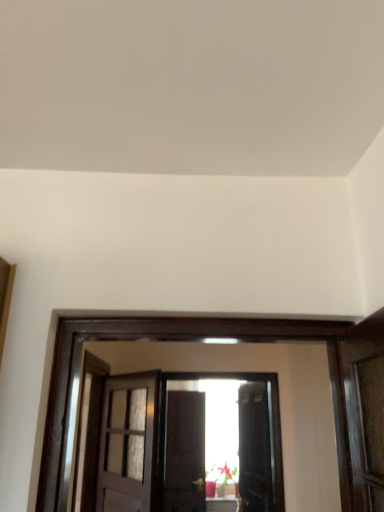
This screenshot has height=512, width=384. What do you see at coordinates (127, 443) in the screenshot? I see `matte white door at center, which is counted as the first door, starting from the left` at bounding box center [127, 443].

What are the coordinates of `matte white door at center, marked as the 2th door in a back-to-front arrangement` in the screenshot? It's located at click(127, 443).

The image size is (384, 512). What do you see at coordinates (254, 449) in the screenshot?
I see `matte black door at center, the first door from the right` at bounding box center [254, 449].

You are a GUI agent. You are given a task and a screenshot of the screen. Output one action in this format:
    pyautogui.click(x=<x>, y=<y>)
    Task: Click on the matte black door at center, marked as the second door in a left-to-right arrangement
    The image size is (384, 512).
    Given the screenshot: What is the action you would take?
    pyautogui.click(x=254, y=449)

Identify the location of matte white door at center, which is counted as the first door, starting from the left. (127, 443).

In the image, is matte white door at center, which is counted as the first door, starting from the left, on the left side or the right side of matte black door at center, the first door from the right?

From the image, it's evident that matte white door at center, which is counted as the first door, starting from the left, is to the left of matte black door at center, the first door from the right.

Considering the positions of objects matte white door at center, acting as the first door starting from the front, and matte black door at center, marked as the second door in a left-to-right arrangement, in the image provided, who is behind, matte white door at center, acting as the first door starting from the front, or matte black door at center, marked as the second door in a left-to-right arrangement,?

matte black door at center, marked as the second door in a left-to-right arrangement, is further from the camera.

Which point is more forward, (110, 511) or (269, 437)?

Point (110, 511)

Consider the image. From the image's perspective, does matte white door at center, marked as the 2th door in a back-to-front arrangement, appear lower than matte black door at center, marked as the second door in a left-to-right arrangement?

Actually, matte white door at center, marked as the 2th door in a back-to-front arrangement, appears above matte black door at center, marked as the second door in a left-to-right arrangement, in the image.

From a real-world perspective, is matte white door at center, marked as the 2th door in a back-to-front arrangement, below matte black door at center, which appears as the second door when viewed from the front?

No, from a real-world perspective, matte white door at center, marked as the 2th door in a back-to-front arrangement, is not beneath matte black door at center, which appears as the second door when viewed from the front.

Does matte white door at center, acting as the first door starting from the front, have a lesser width compared to matte black door at center, which appears as the second door when viewed from the front?

Correct, the width of matte white door at center, acting as the first door starting from the front, is less than that of matte black door at center, which appears as the second door when viewed from the front.

Looking at this image, is matte white door at center, marked as the 2th door in a back-to-front arrangement, taller or shorter than matte black door at center, the 1th door from the back?

matte white door at center, marked as the 2th door in a back-to-front arrangement, is shorter than matte black door at center, the 1th door from the back.

Can you confirm if matte white door at center, marked as the 2th door in a back-to-front arrangement, is bigger than matte black door at center, marked as the second door in a left-to-right arrangement?

Actually, matte white door at center, marked as the 2th door in a back-to-front arrangement, might be smaller than matte black door at center, marked as the second door in a left-to-right arrangement.

Is matte white door at center, the second door positioned from the right, not inside matte black door at center, the first door from the right?

Yes.

Can you see matte white door at center, which is counted as the first door, starting from the left, touching matte black door at center, marked as the second door in a left-to-right arrangement?

No, matte white door at center, which is counted as the first door, starting from the left, is not touching matte black door at center, marked as the second door in a left-to-right arrangement.

Is matte white door at center, the second door positioned from the right, looking in the opposite direction of matte black door at center, which appears as the second door when viewed from the front?

No, matte white door at center, the second door positioned from the right,'s orientation is not away from matte black door at center, which appears as the second door when viewed from the front.

The image size is (384, 512). In order to click on door above the matte black door at center, which appears as the second door when viewed from the front (from a real-world perspective) in this screenshot , I will do coord(127,443).

Does matte black door at center, the 1th door from the back, appear on the left side of matte white door at center, acting as the first door starting from the front?

In fact, matte black door at center, the 1th door from the back, is to the right of matte white door at center, acting as the first door starting from the front.

Who is more distant, matte black door at center, the 1th door from the back, or matte white door at center, marked as the 2th door in a back-to-front arrangement?

matte black door at center, the 1th door from the back, is further from the camera.

Is point (239, 394) positioned before point (140, 487)?

No.

From the image's perspective, is matte black door at center, the 1th door from the back, below matte white door at center, marked as the 2th door in a back-to-front arrangement?

Correct, matte black door at center, the 1th door from the back, appears lower than matte white door at center, marked as the 2th door in a back-to-front arrangement, in the image.

From a real-world perspective, is matte black door at center, marked as the second door in a left-to-right arrangement, located higher than matte white door at center, acting as the first door starting from the front?

No.

Which of these two, matte black door at center, marked as the second door in a left-to-right arrangement, or matte white door at center, which is counted as the first door, starting from the left, is wider?

With larger width is matte black door at center, marked as the second door in a left-to-right arrangement.

Can you confirm if matte black door at center, the 1th door from the back, is taller than matte white door at center, acting as the first door starting from the front?

Yes.

Who is bigger, matte black door at center, marked as the second door in a left-to-right arrangement, or matte white door at center, which is counted as the first door, starting from the left?

Bigger between the two is matte black door at center, marked as the second door in a left-to-right arrangement.

Is matte white door at center, which is counted as the first door, starting from the left, completely or partially inside matte black door at center, marked as the second door in a left-to-right arrangement?

Actually, matte white door at center, which is counted as the first door, starting from the left, is outside matte black door at center, marked as the second door in a left-to-right arrangement.

Would you say matte black door at center, the 1th door from the back, is a long distance from matte white door at center, the second door positioned from the right?

matte black door at center, the 1th door from the back, is positioned a significant distance from matte white door at center, the second door positioned from the right.

Could you tell me if matte black door at center, marked as the second door in a left-to-right arrangement, is facing matte white door at center, the second door positioned from the right?

Yes, matte black door at center, marked as the second door in a left-to-right arrangement, is facing matte white door at center, the second door positioned from the right.

Measure the distance from matte black door at center, marked as the second door in a left-to-right arrangement, to matte white door at center, acting as the first door starting from the front.

matte black door at center, marked as the second door in a left-to-right arrangement, is 3.71 feet from matte white door at center, acting as the first door starting from the front.

Locate an element on the screen. The height and width of the screenshot is (512, 384). door that is on the left side of matte black door at center, marked as the second door in a left-to-right arrangement is located at coordinates (127, 443).

Locate an element on the screen. door in front of the matte black door at center, marked as the second door in a left-to-right arrangement is located at coordinates 127,443.

The image size is (384, 512). Find the location of `door to the right of matte white door at center, acting as the first door starting from the front`. door to the right of matte white door at center, acting as the first door starting from the front is located at coordinates (254, 449).